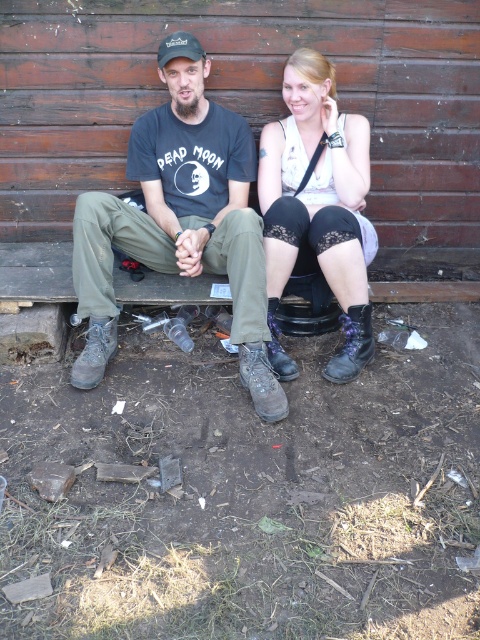
You are standing at the camera position and want to reach the point marked as point (183, 48). If your walking speed is 3 feet per second, how many seconds will it take you to reach that point?

The distance between point (183, 48) and the camera is 9.27 feet. At a speed of 3 feet per second, it will take 9.27 divided by 3, which is approximately 3.09 seconds to reach the point.